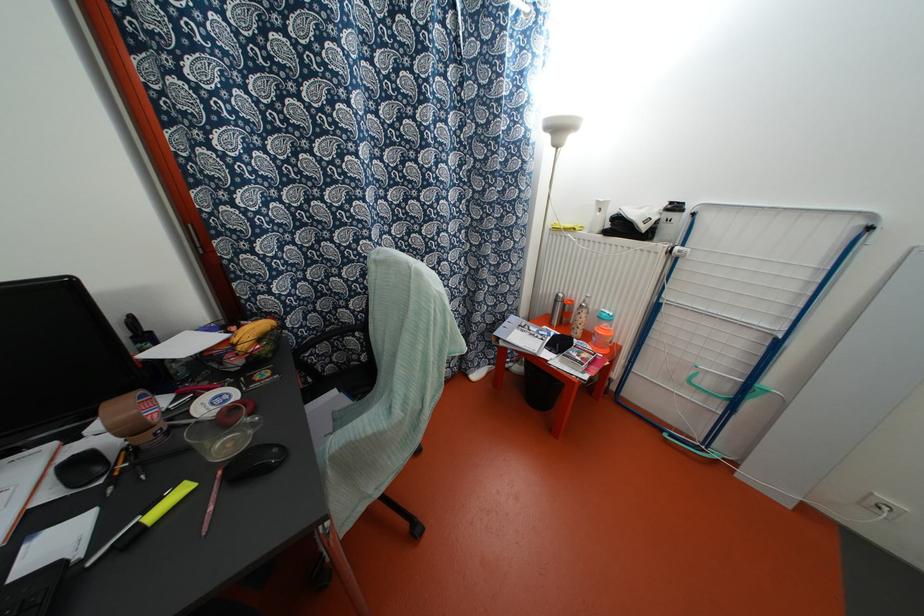
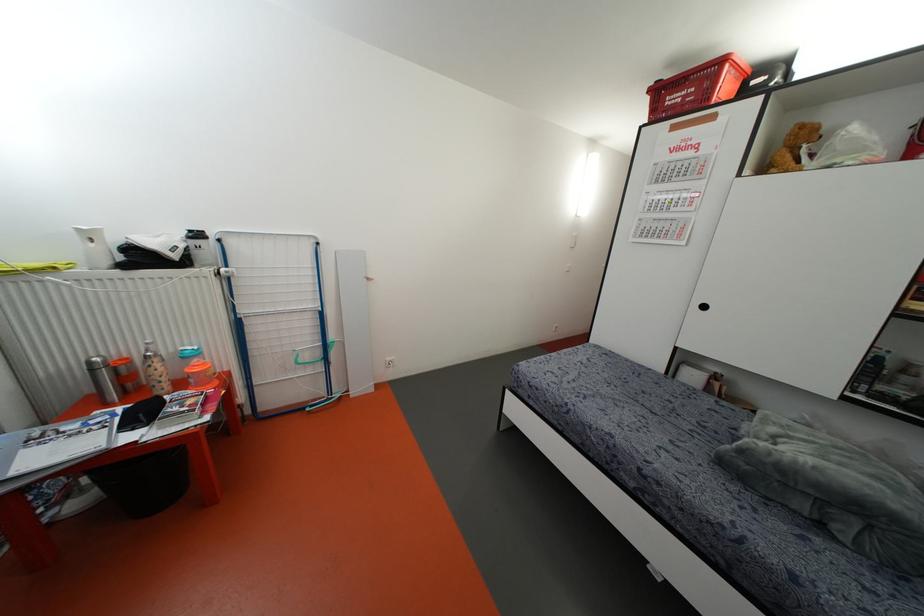
The point at [606,351] is marked in the first image. Where is the corresponding point in the second image?

(215, 383)